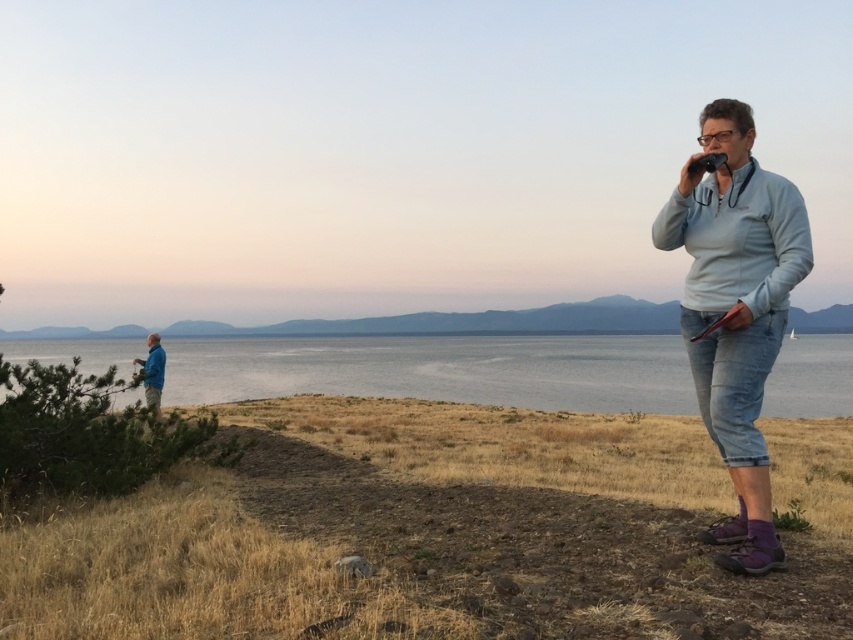
Question: Which is nearer to the light blue fabric jacket at right?

Choices:
 (A) light blue fleece at right
 (B) blue fabric jacket at left

Answer: (A)

Question: Does smooth blue water at center come behind light blue fleece at right?

Choices:
 (A) no
 (B) yes

Answer: (B)

Question: Which object is the closest to the light blue fleece at right?

Choices:
 (A) blue fabric jacket at left
 (B) smooth blue water at center
 (C) light blue fabric jacket at right

Answer: (C)

Question: Does smooth blue water at center come in front of light blue fabric jacket at right?

Choices:
 (A) no
 (B) yes

Answer: (B)

Question: Which point is farther from the camera taking this photo?

Choices:
 (A) (712, 176)
 (B) (155, 392)
 (C) (349, 372)

Answer: (C)

Question: From the image, what is the correct spatial relationship of light blue fabric jacket at right in relation to blue fabric jacket at left?

Choices:
 (A) right
 (B) left

Answer: (A)